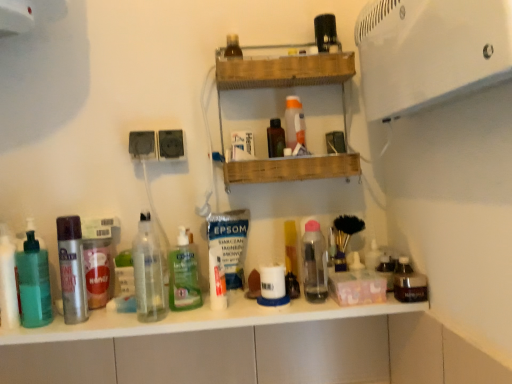
Locate an element on the screen. This screenshot has height=384, width=512. free space that is in between clear glass bottle at center, the 3th bottle from the left, and white plastic jar at center, the 1th toiletry positioned from the right is located at coordinates (214, 316).